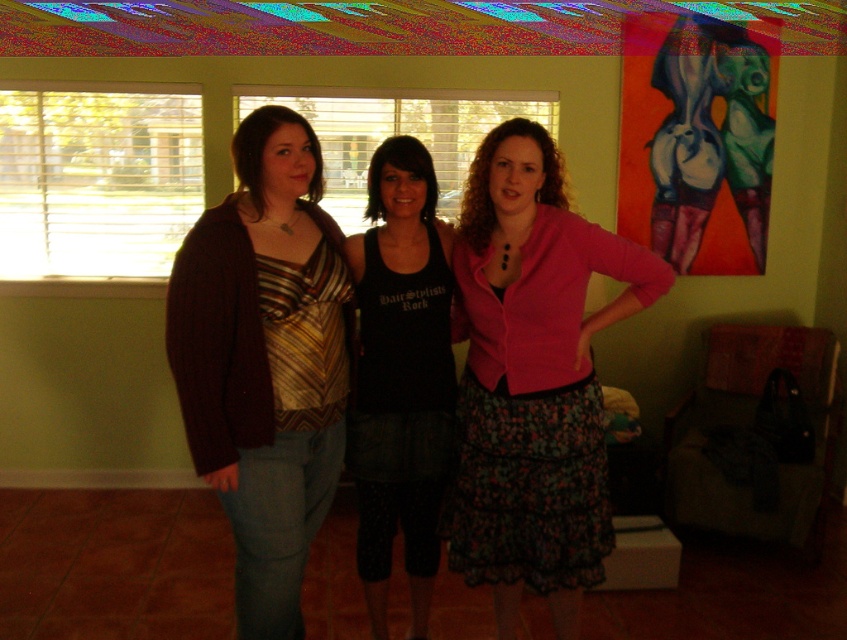
Is the position of pink matte cardigan at center more distant than that of black tank top at center?

No, it is not.

Which is in front, point (484, 141) or point (403, 202)?

Point (484, 141) is more forward.

I want to click on pink matte cardigan at center, so click(532, 378).

Between pink matte cardigan at center and matte brown cardigan at center, which one is positioned lower?

pink matte cardigan at center is below.

Between point (461, 384) and point (331, 372), which one is positioned behind?

The point (461, 384) is more distant.

Find the location of a particular element. pink matte cardigan at center is located at coordinates (532, 378).

Is matte brown cardigan at center above black tank top at center?

Indeed, matte brown cardigan at center is positioned over black tank top at center.

Which is below, matte brown cardigan at center or black tank top at center?

black tank top at center

The height and width of the screenshot is (640, 847). What do you see at coordinates (264, 360) in the screenshot?
I see `matte brown cardigan at center` at bounding box center [264, 360].

Locate an element on the screen. The height and width of the screenshot is (640, 847). matte brown cardigan at center is located at coordinates (264, 360).